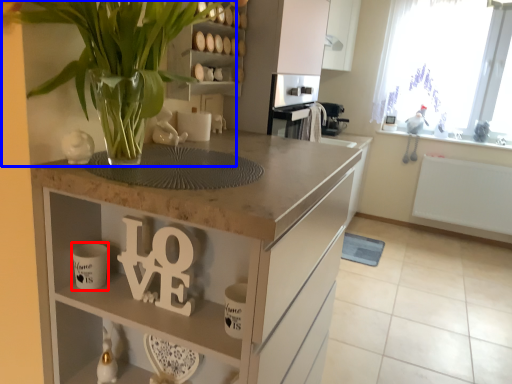
Question: Which object is further to the camera taking this photo, mug (highlighted by a red box) or houseplant (highlighted by a blue box)?

Choices:
 (A) mug
 (B) houseplant

Answer: (A)